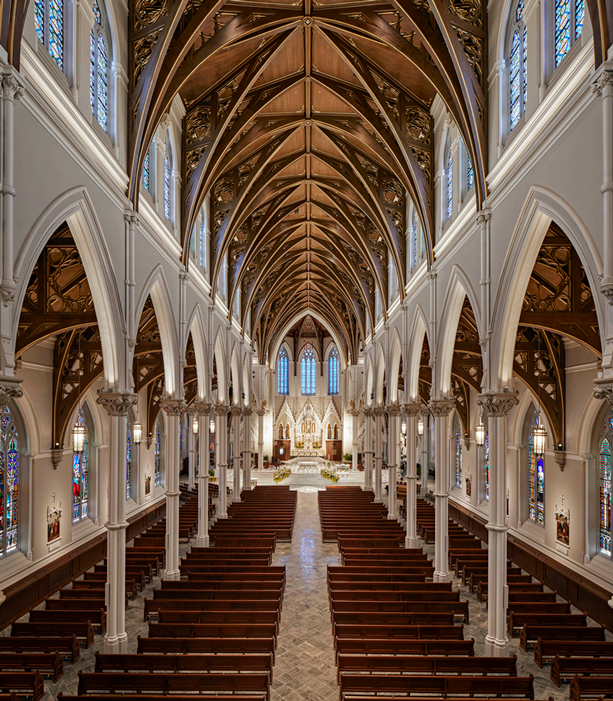
This screenshot has width=613, height=701. Find the location of `beam`. beam is located at coordinates (123, 559).